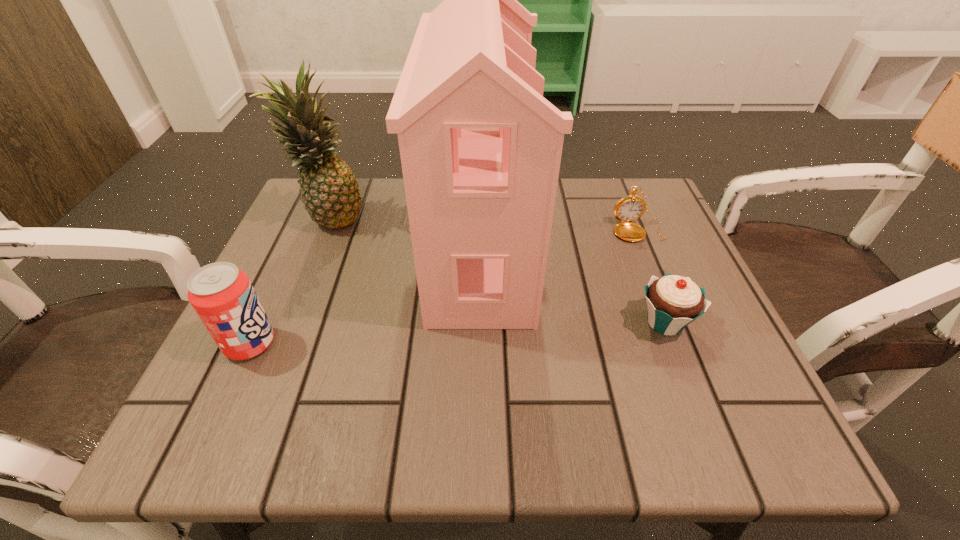
You are a GUI agent. You are given a task and a screenshot of the screen. Output one action in this format:
    pyautogui.click(x=<x>, y=<y>)
    Task: Click on the free point at the far edge
    The image size is (960, 540).
    Given the screenshot: What is the action you would take?
    pyautogui.click(x=586, y=188)

Locate an element on the screen. The width and height of the screenshot is (960, 540). vacant space at the near edge of the desktop is located at coordinates (464, 409).

Where is `free spot at the left edge of the desktop`? The height and width of the screenshot is (540, 960). free spot at the left edge of the desktop is located at coordinates (296, 294).

This screenshot has width=960, height=540. Identify the location of free space at the right edge of the desktop. (642, 270).

The height and width of the screenshot is (540, 960). I want to click on free space at the far left corner of the desktop, so click(358, 230).

Where is `vacant space at the far right corner of the desktop`? Image resolution: width=960 pixels, height=540 pixels. vacant space at the far right corner of the desktop is located at coordinates (635, 184).

The image size is (960, 540). Identify the location of free space that is in between the pocket watch and the cupcake. (652, 276).

Where is `unoccupied area between the cupcake and the tallest object`? This screenshot has width=960, height=540. unoccupied area between the cupcake and the tallest object is located at coordinates (572, 284).

The image size is (960, 540). What are the coordinates of `free spot between the tallest object and the cupcake` in the screenshot? It's located at (572, 284).

Identify the location of vacant space that's between the tallest object and the pocket watch. (559, 238).